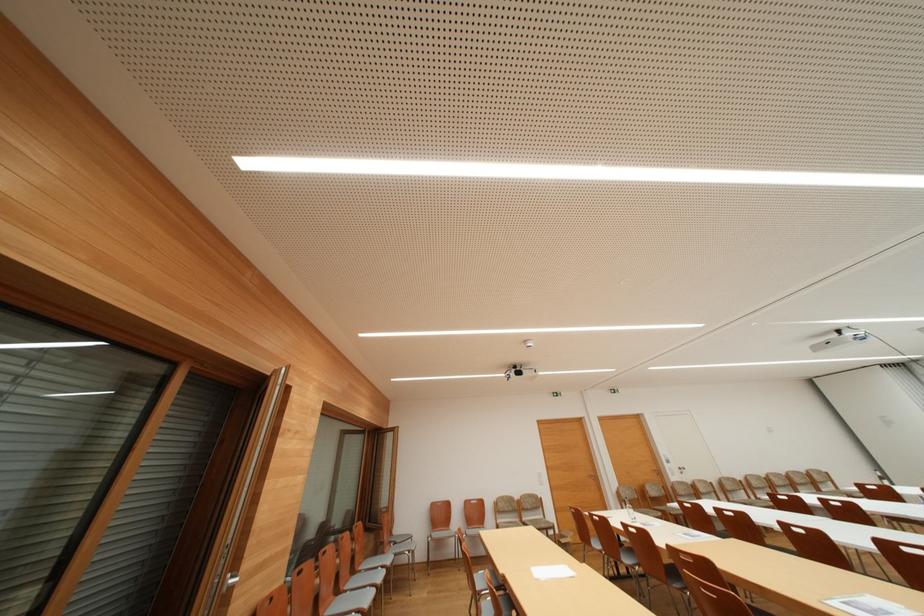
Where is `white door handle`? This screenshot has width=924, height=616. white door handle is located at coordinates (682, 469).